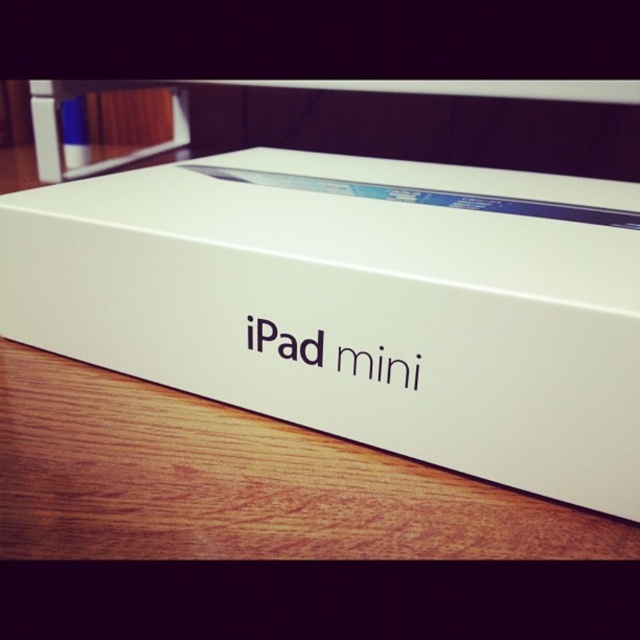
Is point (305, 337) farther from camera compared to point (374, 506)?

Yes.

In order to click on white matte ipad mini at center in this screenshot , I will do `click(356, 304)`.